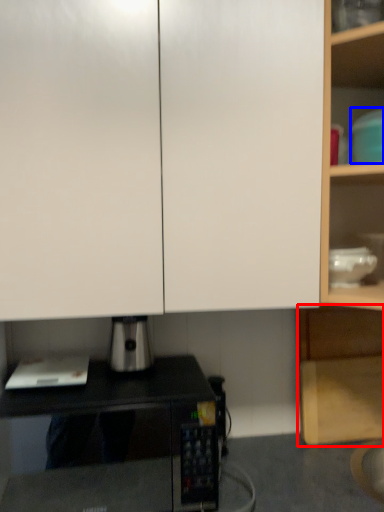
Question: Which of the following is the farthest to the observer, cabinetry (highlighted by a red box) or appliance (highlighted by a blue box)?

Choices:
 (A) cabinetry
 (B) appliance

Answer: (A)